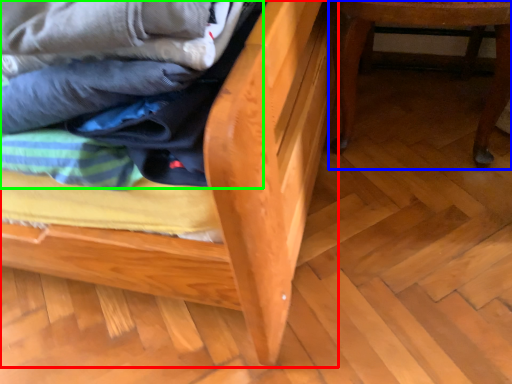
Question: Which object is positioned closest to furniture (highlighted by a red box)? Select from furniture (highlighted by a blue box) and laundry (highlighted by a green box).

Choices:
 (A) furniture
 (B) laundry

Answer: (B)